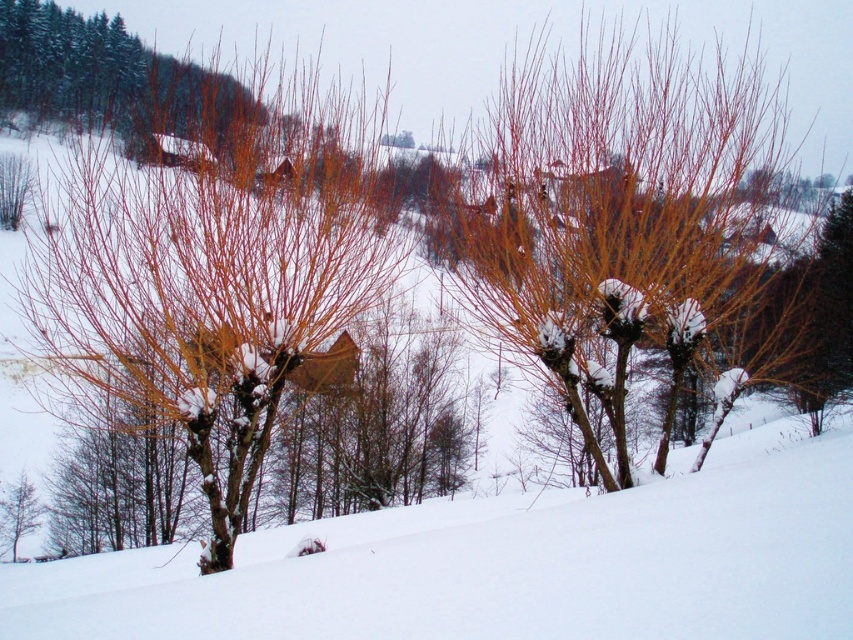
Can you confirm if smooth orange branches at center is thinner than green matte tree at lower left?

Incorrect, smooth orange branches at center's width is not less than green matte tree at lower left's.

Is smooth orange branches at center to the right of green matte tree at lower left from the viewer's perspective?

Correct, you'll find smooth orange branches at center to the right of green matte tree at lower left.

Which is behind, point (262, 378) or point (27, 506)?

Positioned behind is point (27, 506).

What are the coordinates of `smooth orange branches at center` in the screenshot? It's located at (212, 282).

Who is more forward, (556, 305) or (9, 502)?

Point (556, 305) is more forward.

Is smooth bark tree at center wider than green matte tree at lower left?

Indeed, smooth bark tree at center has a greater width compared to green matte tree at lower left.

Where is `smooth bark tree at center`? The height and width of the screenshot is (640, 853). smooth bark tree at center is located at coordinates (630, 225).

The image size is (853, 640). I want to click on smooth bark tree at center, so click(630, 225).

Can you confirm if smooth bark tree at center is smaller than smooth orange branches at center?

Yes.

Between smooth bark tree at center and smooth orange branches at center, which one is positioned lower?

Positioned lower is smooth bark tree at center.

You are a GUI agent. You are given a task and a screenshot of the screen. Output one action in this format:
    pyautogui.click(x=<x>, y=<y>)
    Task: Click on the smooth bark tree at center
    
    Given the screenshot: What is the action you would take?
    pyautogui.click(x=630, y=225)

What are the coordinates of `smooth bark tree at center` in the screenshot? It's located at (630, 225).